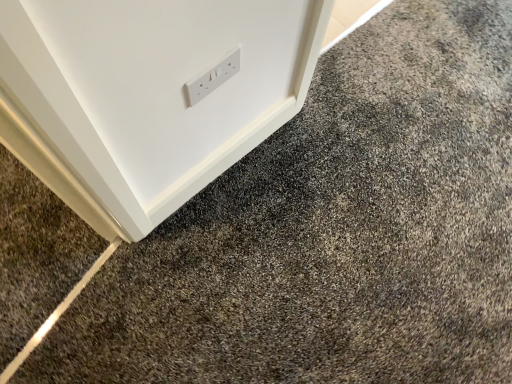
Locate an element on the screen. Image resolution: width=512 pixels, height=384 pixels. white plastic power plugs and sockets at upper center is located at coordinates (212, 77).

What is the approximate width of white plastic power plugs and sockets at upper center?

white plastic power plugs and sockets at upper center is 0.77 inches wide.

Image resolution: width=512 pixels, height=384 pixels. What do you see at coordinates (212, 77) in the screenshot? I see `white plastic power plugs and sockets at upper center` at bounding box center [212, 77].

The image size is (512, 384). Find the location of `white plastic power plugs and sockets at upper center`. white plastic power plugs and sockets at upper center is located at coordinates (212, 77).